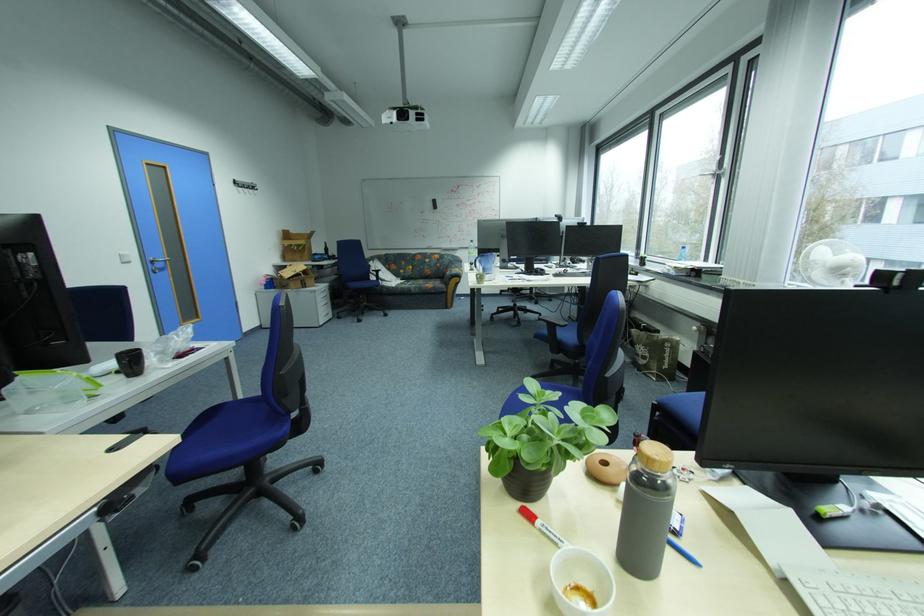
The width and height of the screenshot is (924, 616). Describe the element at coordinates (703, 176) in the screenshot. I see `a window handle` at that location.